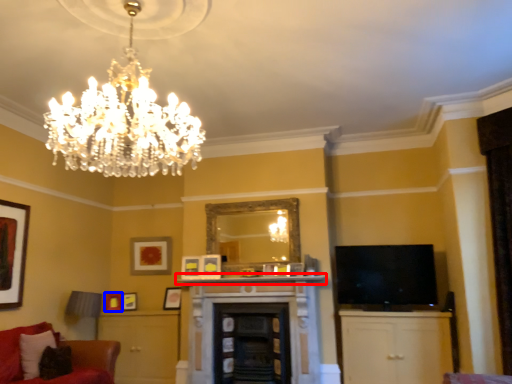
Question: Among these objects, which one is nearest to the camera, mantle (highlighted by a red box) or picture frame (highlighted by a blue box)?

Choices:
 (A) mantle
 (B) picture frame

Answer: (A)